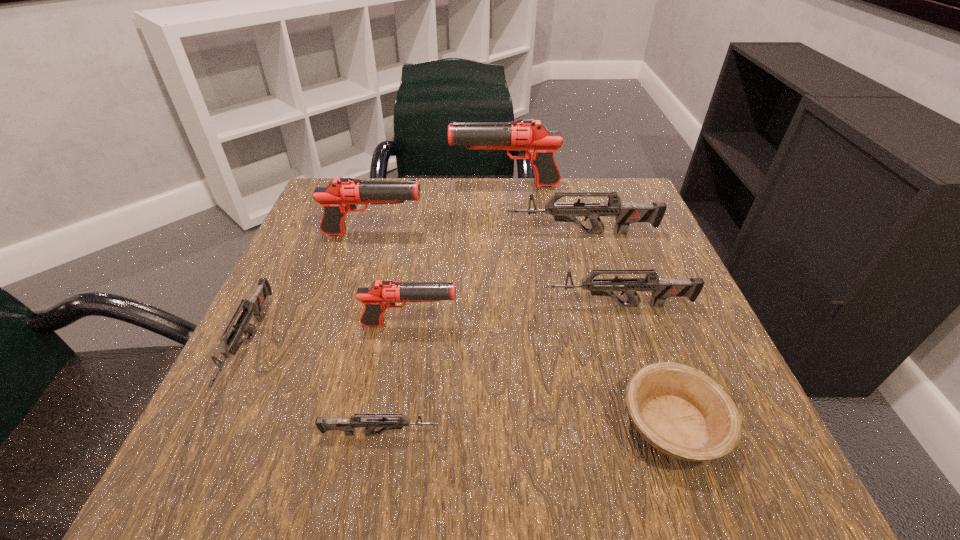
This screenshot has height=540, width=960. Identify the location of free space that is in between the farthest object and the shortest gun. click(x=443, y=310).

The height and width of the screenshot is (540, 960). Identify the location of empty location between the biggest black gun and the fifth tallest object. (562, 246).

The height and width of the screenshot is (540, 960). In order to click on free space between the leftmost grey gun and the farthest gun in this screenshot , I will do [x=377, y=265].

Locate an element on the screen. This screenshot has height=540, width=960. free spot between the biggest black gun and the bowl is located at coordinates (588, 305).

This screenshot has width=960, height=540. What are the coordinates of `vacant space that is in between the farthest grey gun and the nearest gun` in the screenshot? It's located at (481, 334).

What are the coordinates of `free spot between the beige bowl and the fourth shortest object` in the screenshot? It's located at (645, 365).

Locate an element on the screen. Image resolution: width=960 pixels, height=540 pixels. free space between the biggest grey gun and the smallest black gun is located at coordinates (495, 279).

The image size is (960, 540). Find the location of `vacant area that lies between the farthest black gun and the smallest black gun`. vacant area that lies between the farthest black gun and the smallest black gun is located at coordinates (457, 255).

At what (x,y) coordinates should I click in order to perform the action: click on object identified as the fifth closest to the farthest grey gun. Please return your answer as a coordinate pair (x, y). The height and width of the screenshot is (540, 960). Looking at the image, I should click on (682, 412).

Identify which object is the second closest to the tallest object. Please provide its 2D coordinates. Your answer should be formatted as a tuple, i.e. [(x, y)], where the tuple contains the x and y coordinates of a point satisfying the conditions above.

[(626, 213)]